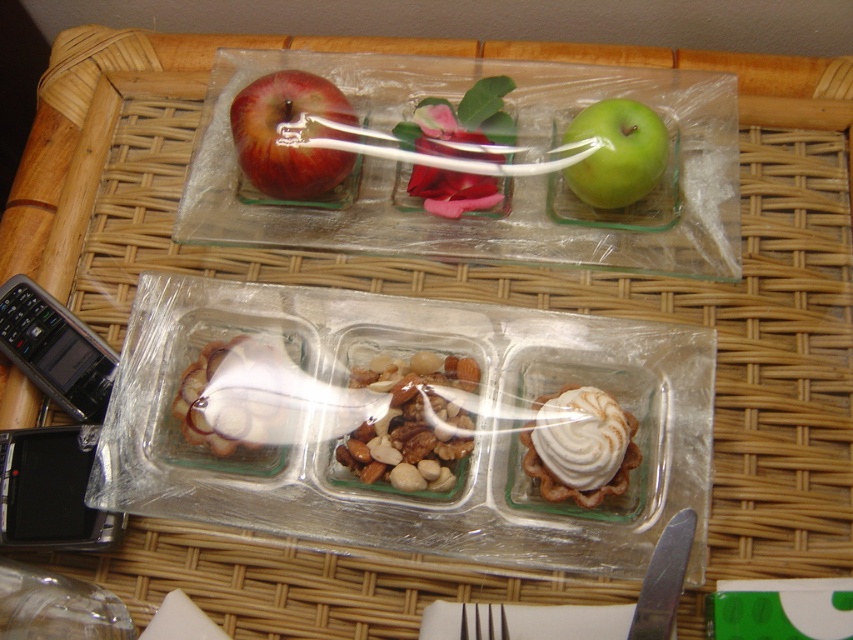
Is shiny red apple at upper left below green matte apple at upper right?

Incorrect, shiny red apple at upper left is not positioned below green matte apple at upper right.

From the picture: Can you confirm if shiny red apple at upper left is shorter than green matte apple at upper right?

In fact, shiny red apple at upper left may be taller than green matte apple at upper right.

Between point (317, 195) and point (592, 189), which one is positioned in front?

Point (592, 189) is more forward.

Locate an element on the screen. The width and height of the screenshot is (853, 640). shiny red apple at upper left is located at coordinates click(279, 134).

Is shiny red apple at upper left below whipped cream pastry at center right?

Incorrect, shiny red apple at upper left is not positioned below whipped cream pastry at center right.

From the picture: Does shiny red apple at upper left come in front of whipped cream pastry at center right?

No, it is behind whipped cream pastry at center right.

What do you see at coordinates (279, 134) in the screenshot? I see `shiny red apple at upper left` at bounding box center [279, 134].

The height and width of the screenshot is (640, 853). Find the location of `shiny red apple at upper left`. shiny red apple at upper left is located at coordinates (279, 134).

How distant is shiny brown nuts at center from shiny red apple at upper left?

The distance of shiny brown nuts at center from shiny red apple at upper left is 8.12 inches.

Does shiny brown nuts at center have a greater height compared to shiny red apple at upper left?

No.

Does point (457, 380) come closer to viewer compared to point (303, 156)?

Yes, point (457, 380) is closer to viewer.

Find the location of a particular element. The height and width of the screenshot is (640, 853). shiny brown nuts at center is located at coordinates (410, 422).